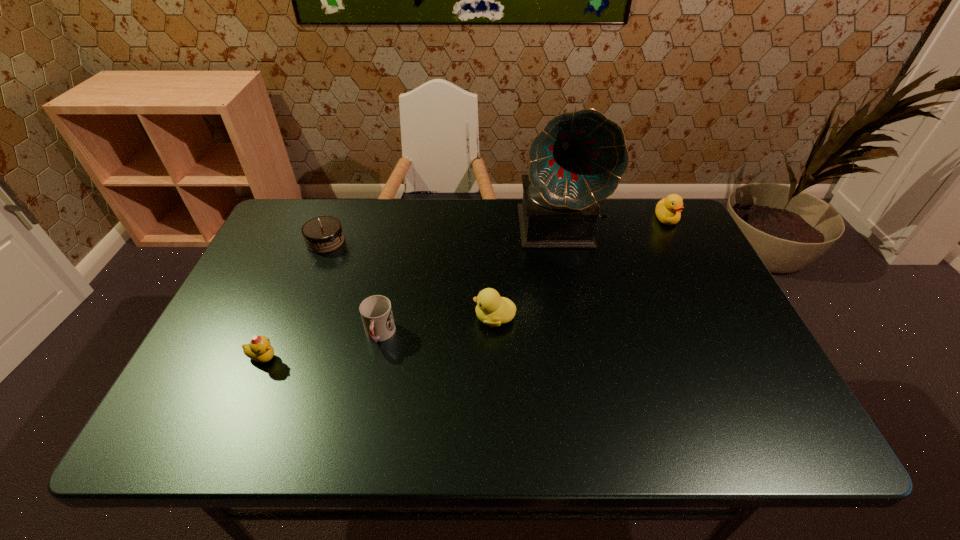
Image resolution: width=960 pixels, height=540 pixels. I want to click on blank area located on the face of the farthest duckling, so click(712, 309).

This screenshot has width=960, height=540. I want to click on vacant space situated at the beak of the fourth object from left to right, so click(x=449, y=318).

Find the location of a particular element. Image resolution: width=960 pixels, height=540 pixels. free spot located 0.290m at the beak of the fourth object from left to right is located at coordinates (356, 318).

Locate an element on the screen. The height and width of the screenshot is (540, 960). free point located at the beak of the fourth object from left to right is located at coordinates (409, 318).

The image size is (960, 540). I want to click on free space located on the front of the chocolate cake, so click(301, 302).

This screenshot has width=960, height=540. Identify the location of free space located on the side of the cup where the handle is located. (360, 430).

The image size is (960, 540). What are the coordinates of `free space located on the front-facing side of the nearest duckling` in the screenshot? It's located at (425, 359).

The image size is (960, 540). I want to click on record player at the far edge, so click(x=578, y=159).

Locate an element on the screen. Image resolution: width=960 pixels, height=540 pixels. duckling positioned at the far edge is located at coordinates (668, 210).

You are a GUI agent. You are given a task and a screenshot of the screen. Output one action in this format:
    pyautogui.click(x=<x>, y=<y>)
    Task: Click on the chocolate cake that is at the far edge
    The height and width of the screenshot is (540, 960).
    Given the screenshot: What is the action you would take?
    pyautogui.click(x=323, y=234)